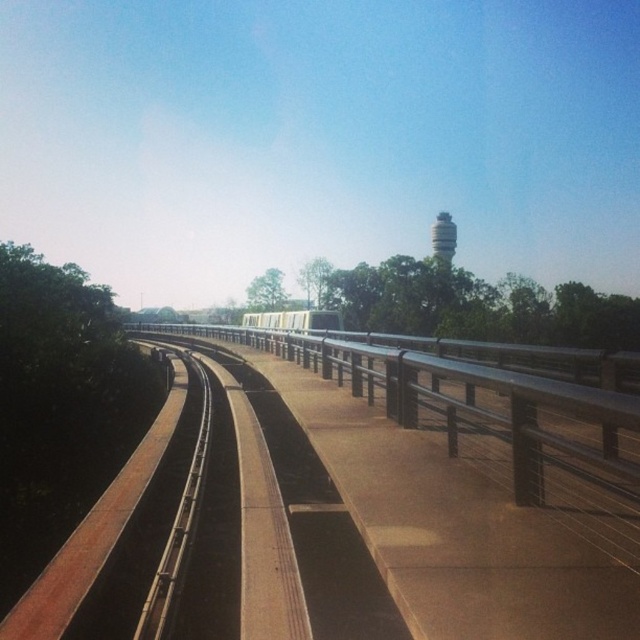
Question: Does metallic silver train at center appear over white matte water tower at upper center?

Choices:
 (A) no
 (B) yes

Answer: (A)

Question: Which point appears closest to the camera in this image?

Choices:
 (A) (337, 320)
 (B) (445, 241)

Answer: (A)

Question: Which object is farther from the camera taking this photo?

Choices:
 (A) metallic silver train at center
 (B) white matte water tower at upper center

Answer: (B)

Question: Which point is closer to the camera?

Choices:
 (A) metallic silver train at center
 (B) white matte water tower at upper center

Answer: (A)

Question: Is metallic silver train at center smaller than white matte water tower at upper center?

Choices:
 (A) yes
 (B) no

Answer: (A)

Question: Considering the relative positions of metallic silver train at center and white matte water tower at upper center in the image provided, where is metallic silver train at center located with respect to white matte water tower at upper center?

Choices:
 (A) below
 (B) above

Answer: (A)